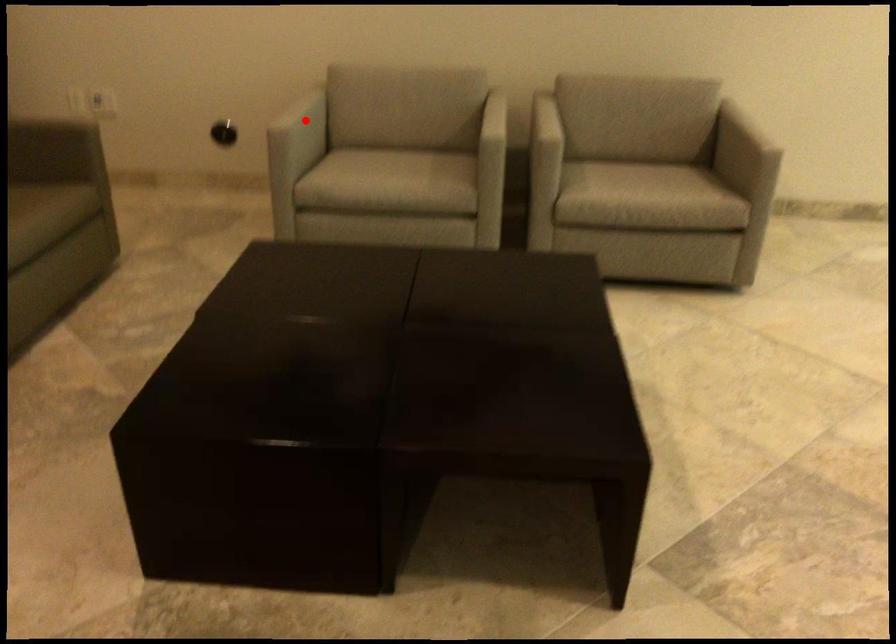
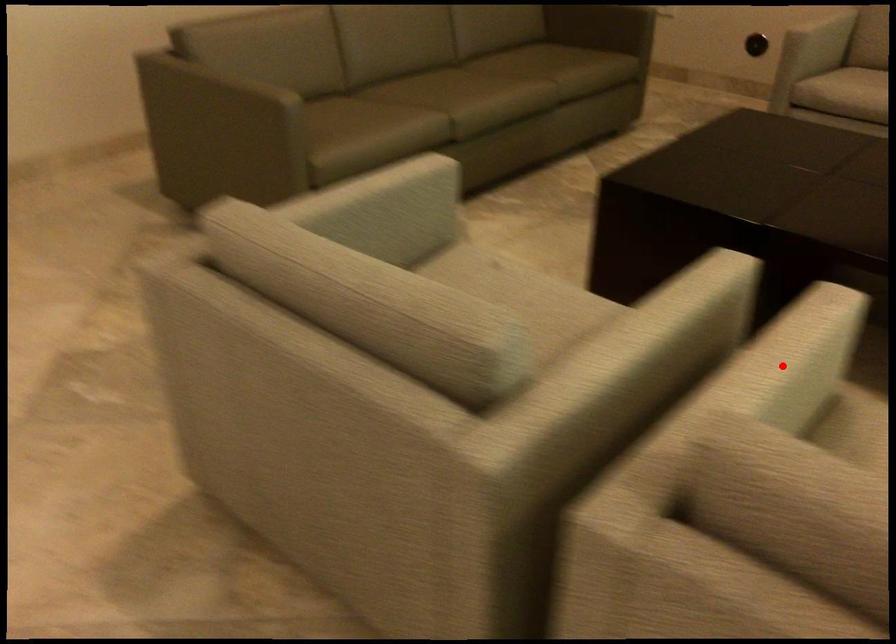
I am providing you with two images of the same scene from different viewpoints. A red point is marked on the first image and another point is marked on the second image. Does the point marked in image1 correspond to the same location as the one in image2?

No